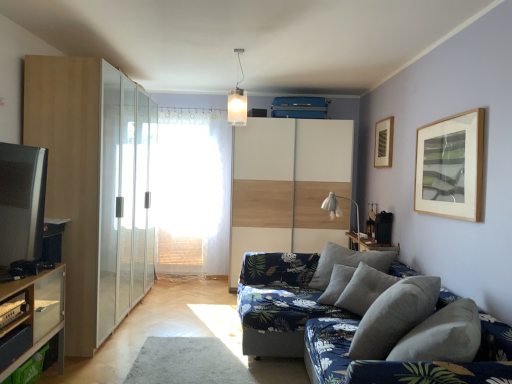
I want to click on empty space that is ontop of white glass pendant light at upper center (from a real-world perspective), so (240, 50).